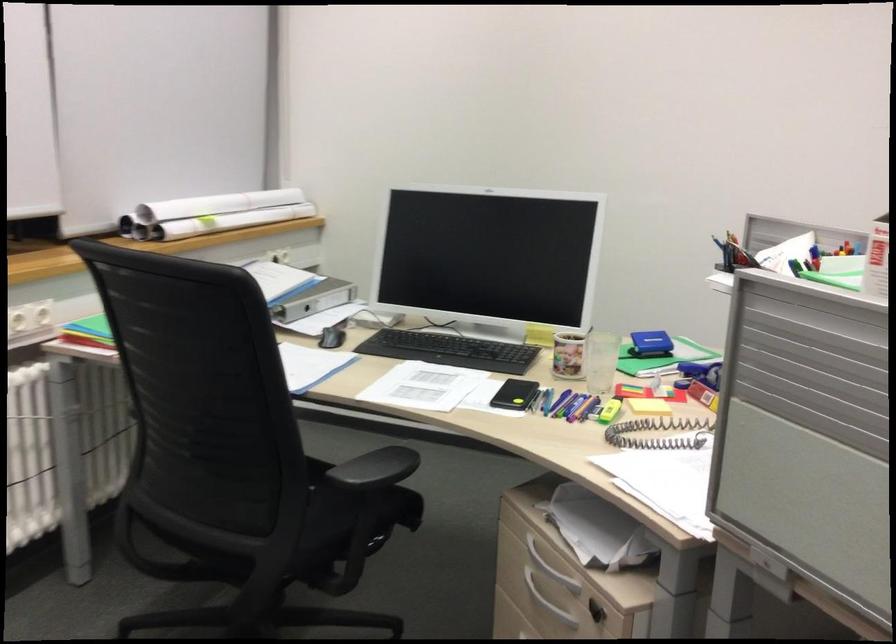
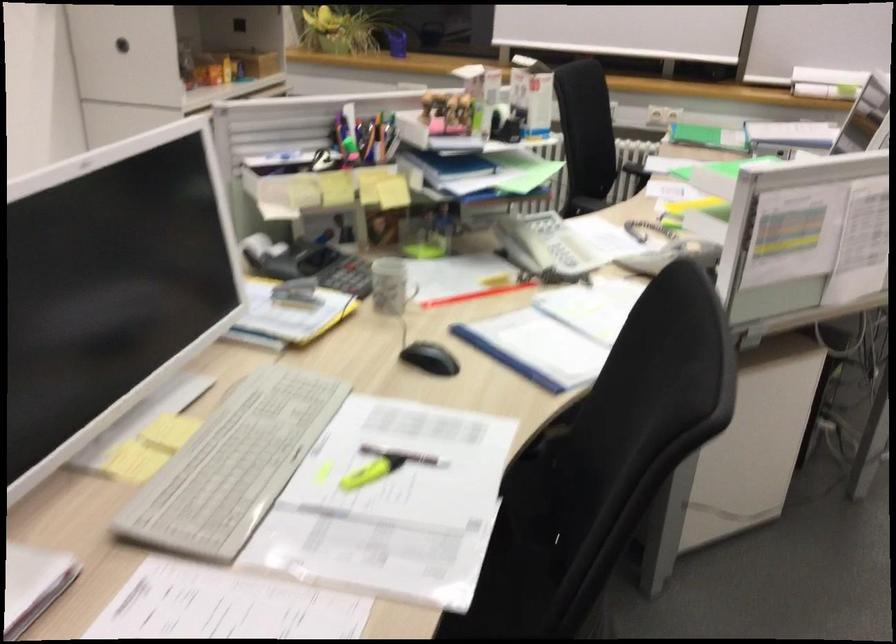
Question: I am providing you with two images of the same scene from different viewpoints. Please identify which objects are invisible in image2.

Choices:
 (A) black chair sitting surface
 (B) silver drawer handle
 (C) toilet flush buttons
 (D) black stapler

Answer: (B)